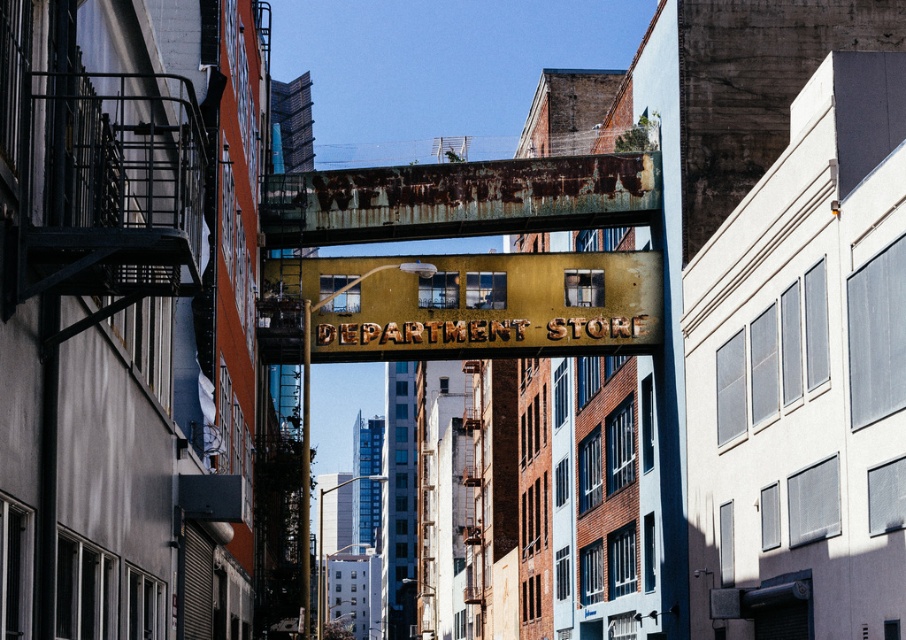
Is rusty gold sign at center positioned at the back of rusty metal sign at center?

No, it is not.

Is point (394, 289) behind point (619, 216)?

No, (394, 289) is in front of (619, 216).

The image size is (906, 640). I want to click on rusty gold sign at center, so 463,305.

At what (x,y) coordinates should I click in order to perform the action: click on rusty gold sign at center. Please return your answer as a coordinate pair (x, y). This screenshot has width=906, height=640. Looking at the image, I should click on (463, 305).